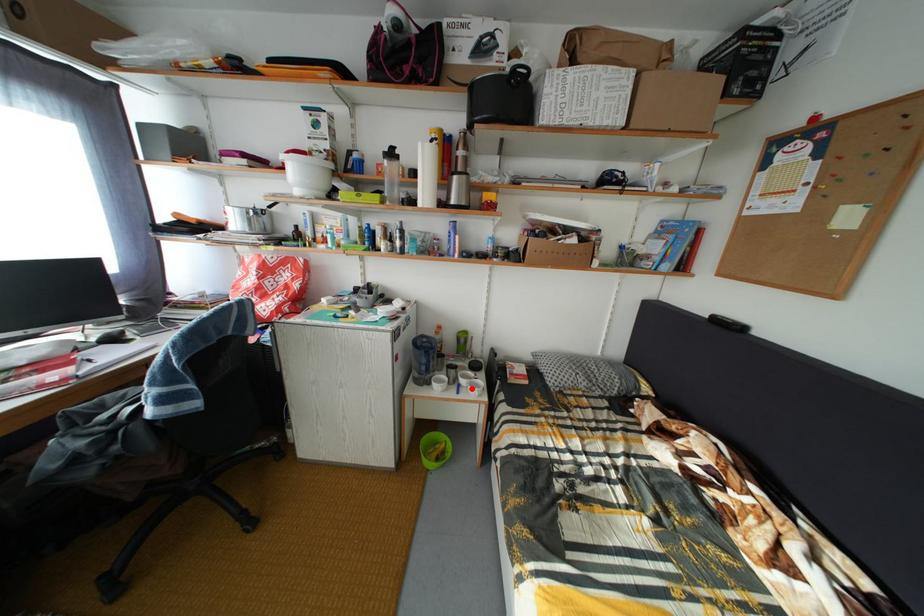
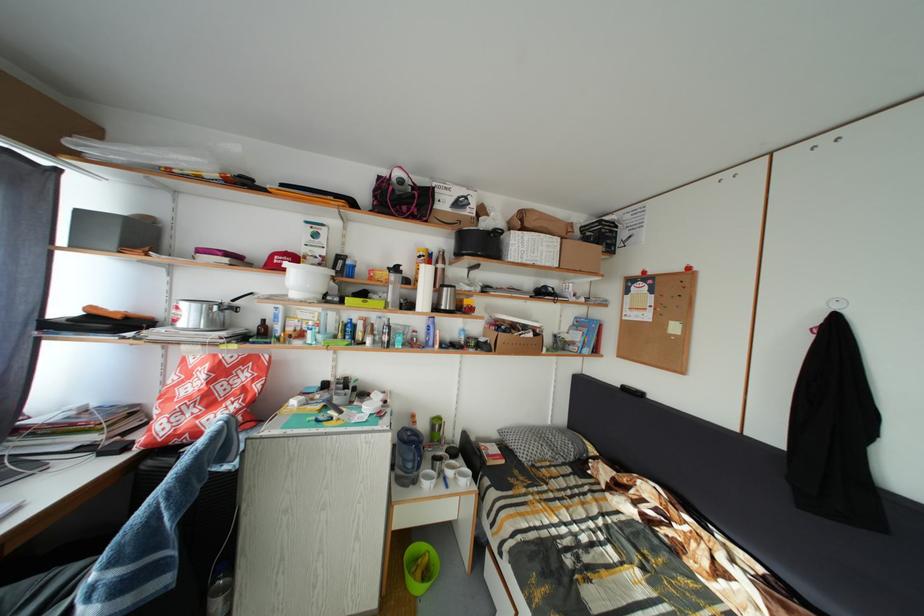
The point at the highlighted location is marked in the first image. Where is the corresponding point in the second image?

(458, 480)